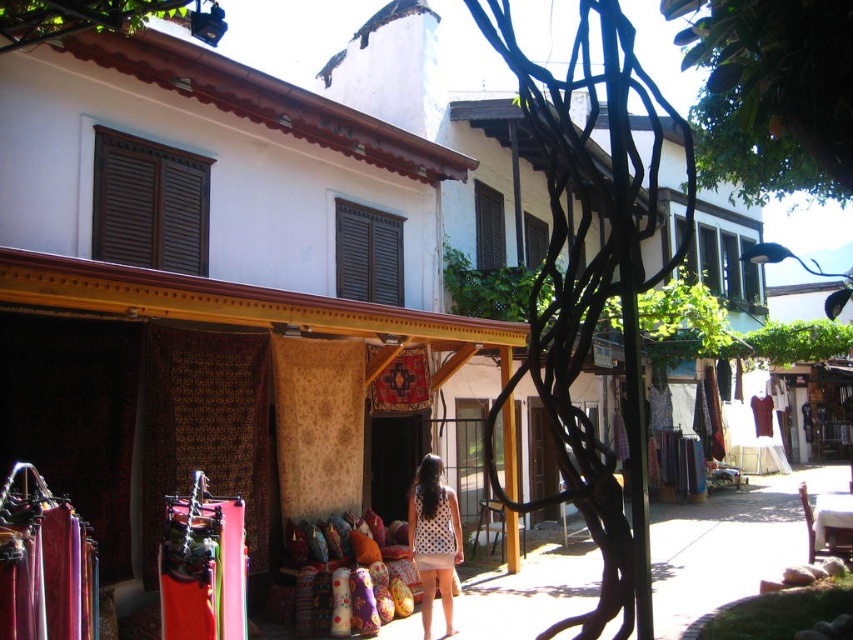
Is green leafy tree at upper right taller than green leafy tree at upper center?

Correct, green leafy tree at upper right is much taller as green leafy tree at upper center.

Can you confirm if green leafy tree at upper right is smaller than green leafy tree at upper center?

No.

This screenshot has width=853, height=640. What do you see at coordinates (772, 93) in the screenshot?
I see `green leafy tree at upper right` at bounding box center [772, 93].

Where is `green leafy tree at upper right`? This screenshot has width=853, height=640. green leafy tree at upper right is located at coordinates (772, 93).

Between point (418, 528) and point (142, 8), which one is positioned behind?

Point (418, 528)

You are a GUI agent. You are given a task and a screenshot of the screen. Output one action in this format:
    pyautogui.click(x=<x>, y=<y>)
    Task: Click on the white dotted dress at center
    Image resolution: width=853 pixels, height=640 pixels.
    Given the screenshot: What is the action you would take?
    pyautogui.click(x=433, y=540)

Is green leafy tree at upper right above white dotted dress at center?

Correct, green leafy tree at upper right is located above white dotted dress at center.

Does green leafy tree at upper right appear under white dotted dress at center?

No, green leafy tree at upper right is not below white dotted dress at center.

Locate an element on the screen. This screenshot has width=853, height=640. green leafy tree at upper right is located at coordinates (772, 93).